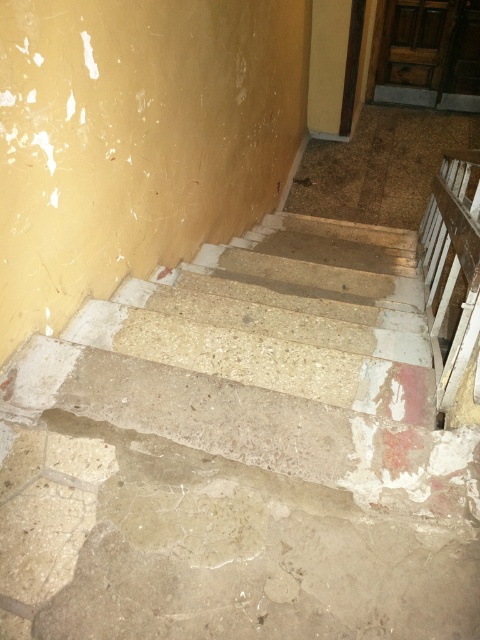
Can you confirm if concrete stairs at center is positioned to the left of white wooden rail at right?

Yes, concrete stairs at center is to the left of white wooden rail at right.

Which is in front, point (334, 248) or point (444, 316)?

Point (444, 316)

You are a GUI agent. You are given a task and a screenshot of the screen. Output one action in this format:
    pyautogui.click(x=<x>, y=<y>)
    Task: Click on the concrete stairs at center
    
    Given the screenshot: What is the action you would take?
    pyautogui.click(x=268, y=365)